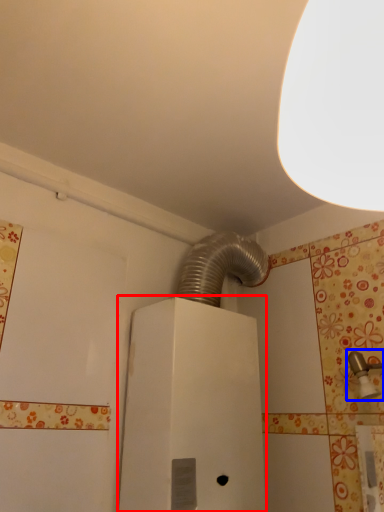
Question: Which object appears farthest to the camera in this image, water heater (highlighted by a red box) or plumbing fixture (highlighted by a blue box)?

Choices:
 (A) water heater
 (B) plumbing fixture

Answer: (A)